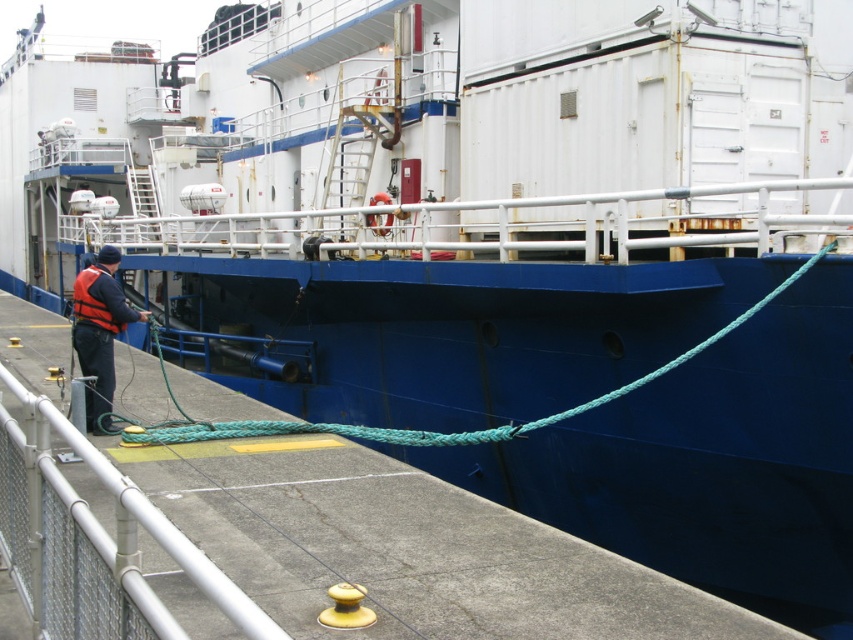
Question: Which of the following is the closest to the observer?

Choices:
 (A) matte orange life vest at left
 (B) green rope at lower left

Answer: (B)

Question: Among these objects, which one is farthest from the camera?

Choices:
 (A) green rope at lower left
 (B) matte orange life vest at left

Answer: (B)

Question: Which point is closer to the camera?

Choices:
 (A) matte orange life vest at left
 (B) green rope at lower left

Answer: (B)

Question: Can you confirm if green rope at lower left is bigger than matte orange life vest at left?

Choices:
 (A) yes
 (B) no

Answer: (A)

Question: Is the position of green rope at lower left less distant than that of matte orange life vest at left?

Choices:
 (A) yes
 (B) no

Answer: (A)

Question: Is green rope at lower left further to the viewer compared to matte orange life vest at left?

Choices:
 (A) yes
 (B) no

Answer: (B)